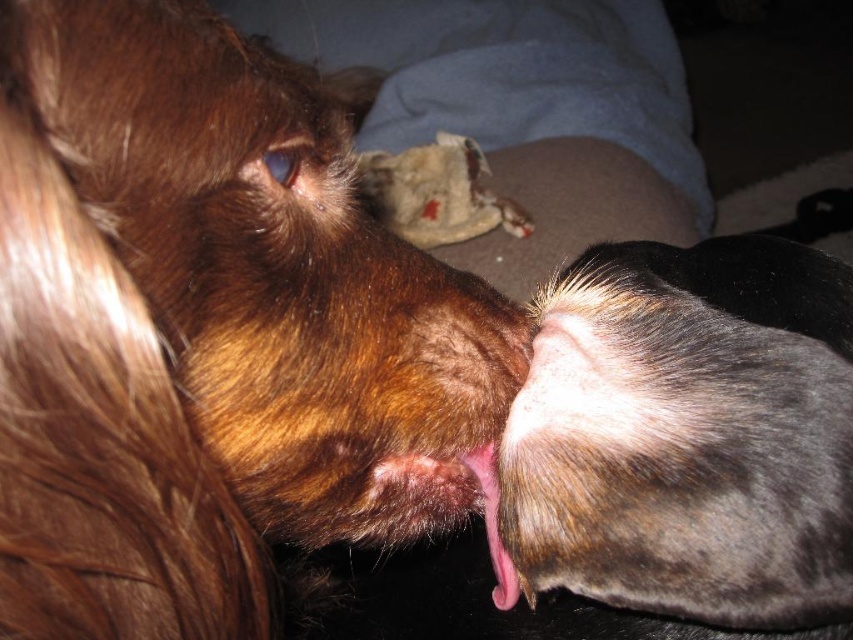
You are a photographer trying to capture a close shot of the fuzzy brown dog at lower right. The camera you are using has a minimum focusing distance of 15 inches. Will you be able to take the photo without moving closer?

The fuzzy brown dog at lower right is 15.24 inches away from camera, which is slightly beyond the camera minimum focusing distance of 15 inches. Therefore, you will need to move closer to capture the photo.

You are a photographer trying to capture a close shot of the pink flesh at center. However, the brown furry dog at upper left is blocking your view. Can you move the dog to the side to get a clear shot?

The brown furry dog at upper left is positioned over the pink flesh at center, so moving the dog to the side would allow you to get a clear shot of the pink flesh at center.

You are a photographer trying to capture a photo of the brown furry dog at upper left and the fuzzy brown dog at lower right. Since you want to ensure both dogs are centered in the frame, which dog should you position closer to the center of the camera viewfinder?

The brown furry dog at upper left should be positioned closer to the center of the camera viewfinder because it is on the left side of the fuzzy brown dog at lower right, so moving it towards the center would help balance both dogs within the frame.